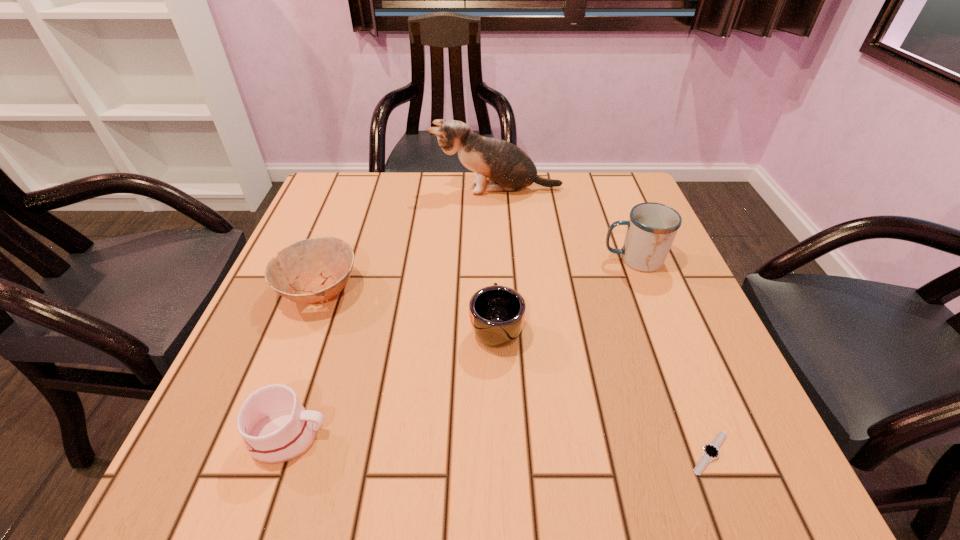
You are a GUI agent. You are given a task and a screenshot of the screen. Output one action in this format:
    pyautogui.click(x=<x>, y=<y>)
    Task: Click on the vacant space situated 0.130m at the face of the farthest object
    The width and height of the screenshot is (960, 540).
    Given the screenshot: What is the action you would take?
    pyautogui.click(x=385, y=190)

Identify the location of free space located on the handle side of the rightmost mug. (468, 260).

Where is `vacant space situated on the handle side of the rightmost mug`? vacant space situated on the handle side of the rightmost mug is located at coordinates (436, 260).

Locate an element on the screen. Image resolution: width=960 pixels, height=540 pixels. free point located 0.280m on the handle side of the rightmost mug is located at coordinates click(476, 260).

Locate an element on the screen. Image resolution: width=960 pixels, height=540 pixels. vacant space located 0.060m on the side of the second mug from right to left with the handle is located at coordinates (494, 281).

In order to click on vacant point located 0.230m on the side of the second mug from right to left with the handle in this screenshot , I will do `click(492, 232)`.

Locate an element on the screen. The image size is (960, 540). free location located on the side of the second mug from right to left with the handle is located at coordinates (492, 198).

Identify the location of free space located 0.180m on the back of the bowl. (348, 215).

I want to click on free spot located on the side with the handle of the leftmost mug, so click(x=536, y=436).

The height and width of the screenshot is (540, 960). I want to click on vacant region located on the left of the watch, so click(x=459, y=453).